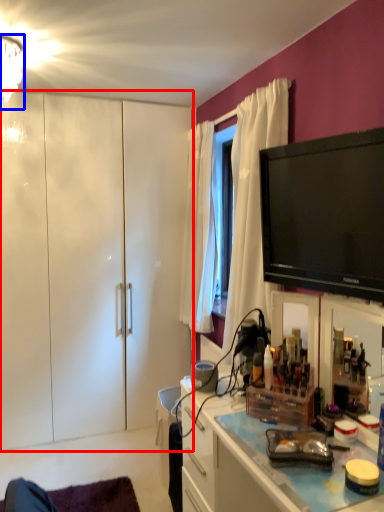
Question: Among these objects, which one is farthest to the camera, cabinetry (highlighted by a red box) or lamp (highlighted by a blue box)?

Choices:
 (A) cabinetry
 (B) lamp

Answer: (A)